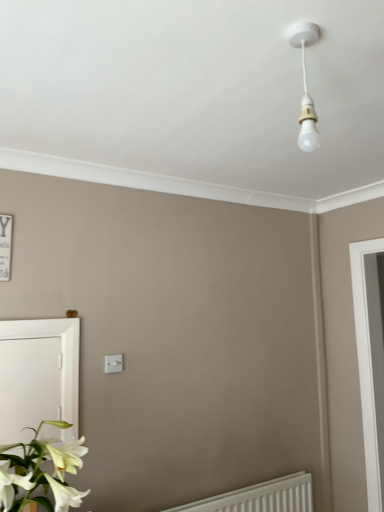
Question: Would you say white glossy flower at lower left is to the left or to the right of white plastic light switch at center in the picture?

Choices:
 (A) right
 (B) left

Answer: (B)

Question: Looking at their shapes, would you say white glossy flower at lower left is wider or thinner than white plastic light switch at center?

Choices:
 (A) wide
 (B) thin

Answer: (A)

Question: Based on their relative distances, which object is farther from the white glossy flower at lower left?

Choices:
 (A) white plastic light switch at center
 (B) white plastic radiator at lower right
 (C) white glossy screen door at lower left

Answer: (B)

Question: Estimate the real-world distances between objects in this image. Which object is farther from the white glossy flower at lower left?

Choices:
 (A) white glossy screen door at lower left
 (B) white plastic radiator at lower right
 (C) white plastic light switch at center

Answer: (B)